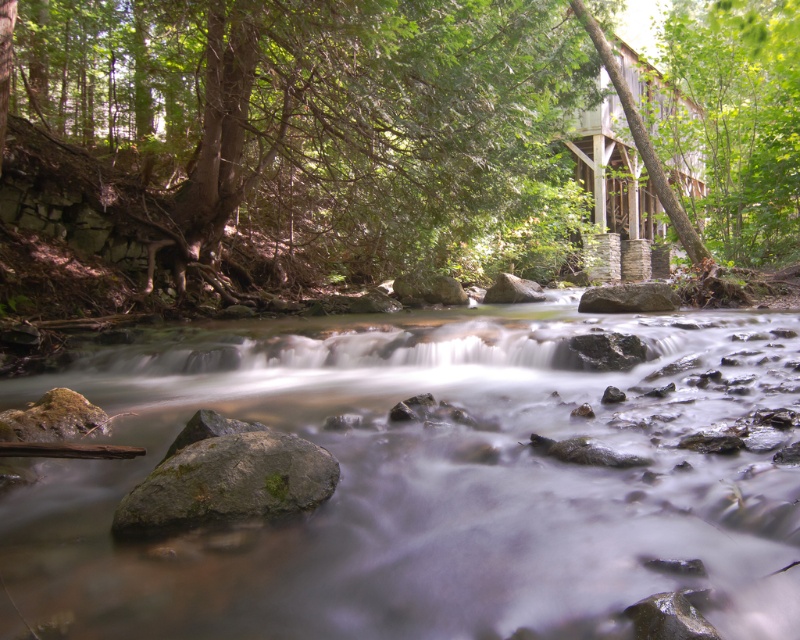
Question: Which point is farther to the camera?

Choices:
 (A) clear water at center
 (B) gray smooth rock at center
 (C) smooth gray rock at center

Answer: (B)

Question: Which point appears closest to the camera in this image?

Choices:
 (A) (486, 253)
 (B) (18, 429)
 (C) (448, 301)

Answer: (B)

Question: Can you confirm if green mossy rock at lower left is positioned above gray smooth rock at center?

Choices:
 (A) no
 (B) yes

Answer: (A)

Question: Can you confirm if green mossy rock at lower left is positioned to the left of gray smooth rock at center?

Choices:
 (A) yes
 (B) no

Answer: (A)

Question: Considering the real-world distances, which object is farthest from the smooth gray rock at center?

Choices:
 (A) clear water at center
 (B) green mossy rock at center
 (C) green mossy rock at lower left
 (D) gray smooth rock at center

Answer: (B)

Question: Is the position of smooth gray rock at center more distant than that of gray smooth rock at center?

Choices:
 (A) yes
 (B) no

Answer: (B)